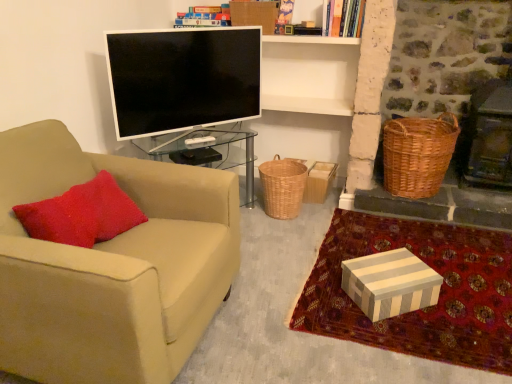
The image size is (512, 384). What are the coordinates of `unoccupied area in front of woven brown basket at center` in the screenshot? It's located at (290, 229).